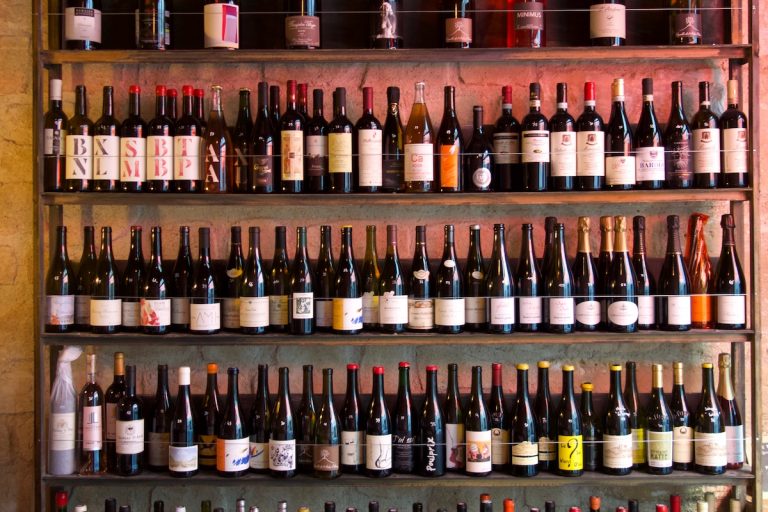
Locate an element on the screen. The width and height of the screenshot is (768, 512). bottle on the top shelf is located at coordinates (85, 31), (144, 38), (227, 41), (300, 36), (386, 31), (464, 32), (528, 36), (607, 36), (693, 34).